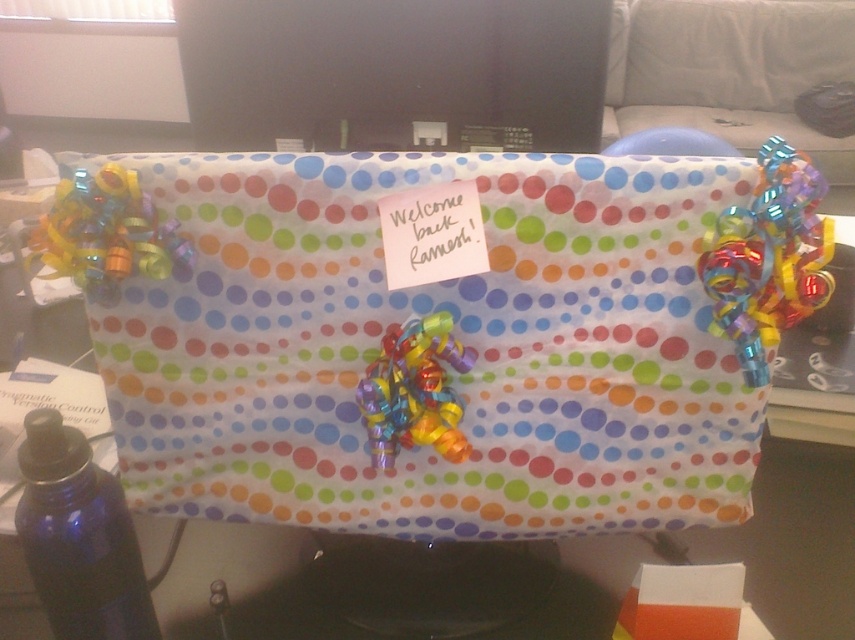
Between point (724, 432) and point (95, 564), which one is positioned behind?

Positioned behind is point (724, 432).

Who is shorter, polka dot wrapping paper at center or blue glass bottle at lower left?

blue glass bottle at lower left is shorter.

Where is `polka dot wrapping paper at center`? Image resolution: width=855 pixels, height=640 pixels. polka dot wrapping paper at center is located at coordinates (370, 362).

The height and width of the screenshot is (640, 855). I want to click on polka dot wrapping paper at center, so click(370, 362).